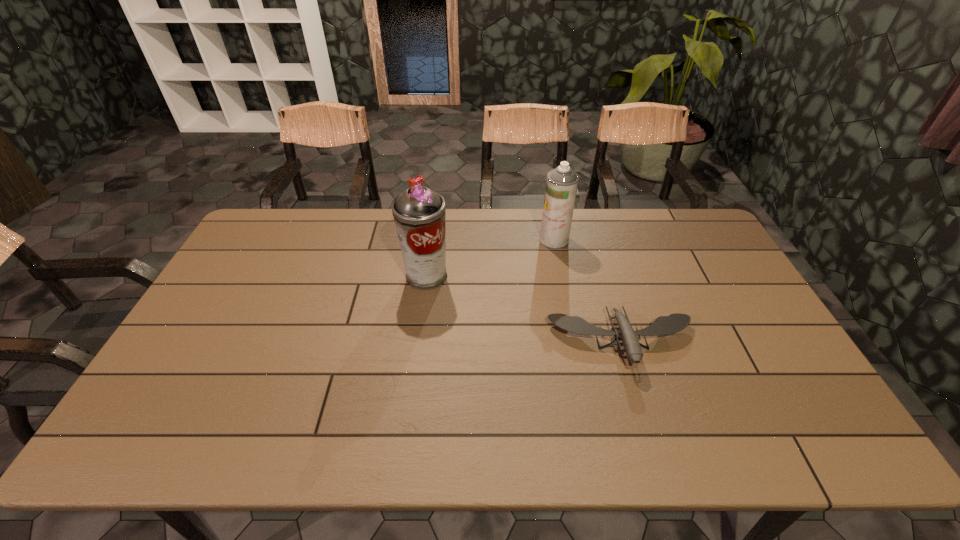
In order to click on the leftmost object in this screenshot , I will do `click(419, 212)`.

This screenshot has height=540, width=960. I want to click on the tallest object, so click(x=419, y=212).

What are the coordinates of `the second tallest object` in the screenshot? It's located at (561, 184).

Locate an element on the screen. This screenshot has width=960, height=540. the farther aerosol can is located at coordinates (561, 184).

Where is `the shortest object`? Image resolution: width=960 pixels, height=540 pixels. the shortest object is located at coordinates (663, 325).

Identify the location of the nearest object. tap(663, 325).

At what (x,y) coordinates should I click in order to perform the action: click on vacant space located on the left of the nearer aerosol can. Please return your answer as a coordinate pair (x, y). This screenshot has width=960, height=540. Looking at the image, I should click on (290, 276).

The width and height of the screenshot is (960, 540). What are the coordinates of `vacant region located 0.150m on the front of the farther aerosol can` in the screenshot? It's located at (562, 279).

Where is `vacant region located at the head of the nearest object`? Image resolution: width=960 pixels, height=540 pixels. vacant region located at the head of the nearest object is located at coordinates (640, 404).

Where is `object situated at the far edge`? object situated at the far edge is located at coordinates (561, 184).